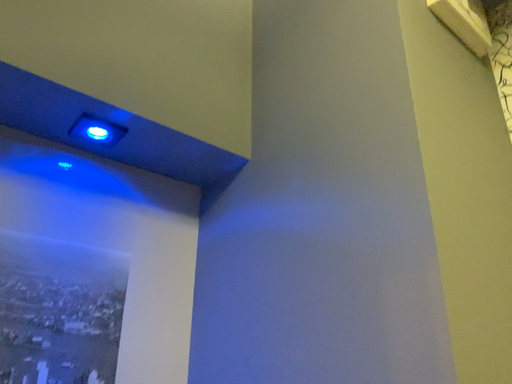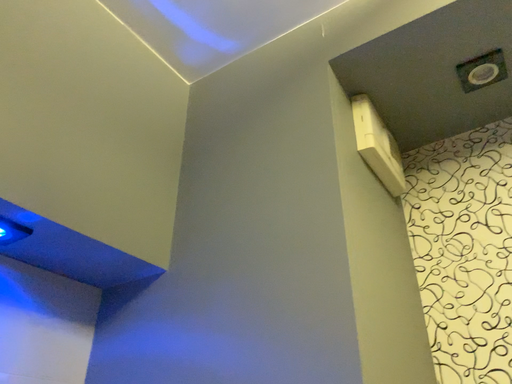
Question: Which way did the camera rotate in the video?

Choices:
 (A) rotated left
 (B) rotated right

Answer: (B)